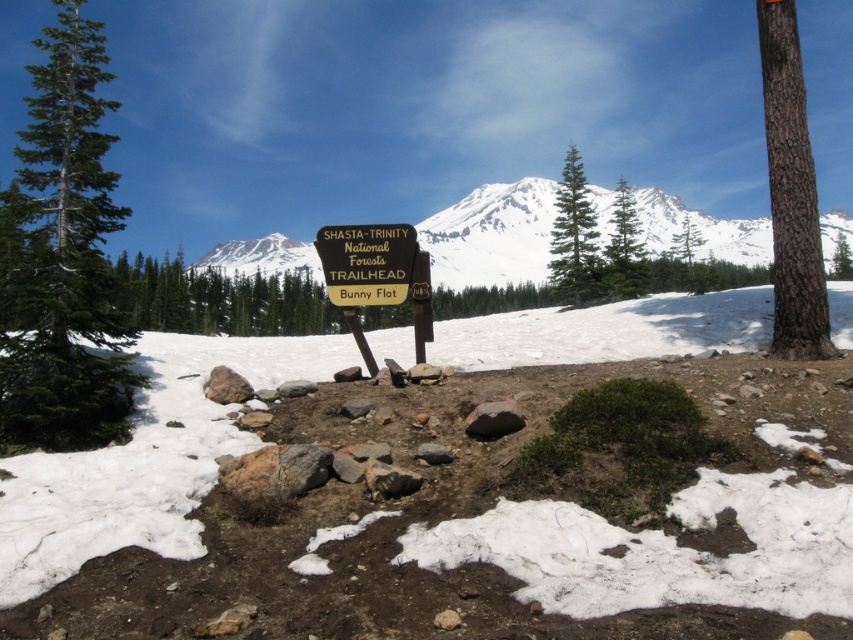
Does snowy white mountain at center have a lesser height compared to green matte tree at center?

Correct, snowy white mountain at center is not as tall as green matte tree at center.

Who is lower down, snowy white mountain at center or green matte tree at center?

snowy white mountain at center

Describe the element at coordinates (492, 236) in the screenshot. This screenshot has width=853, height=640. I see `snowy white mountain at center` at that location.

At what (x,y) coordinates should I click in order to perform the action: click on snowy white mountain at center. Please return your answer as a coordinate pair (x, y). Image resolution: width=853 pixels, height=640 pixels. Looking at the image, I should click on (492, 236).

From the picture: Measure the distance between brown rough bark tree at right and camera.

They are 13.50 meters apart.

Who is positioned more to the left, brown rough bark tree at right or yellow wood sign at center?

Positioned to the left is yellow wood sign at center.

Between point (776, 168) and point (334, 243), which one is positioned in front?

Positioned in front is point (776, 168).

Image resolution: width=853 pixels, height=640 pixels. I want to click on brown rough bark tree at right, so click(791, 193).

From the picture: Is yellow wood sign at center closer to camera compared to green textured pine tree at upper center?

Yes, it is.

Does point (363, 266) come farther from viewer compared to point (618, 268)?

That is False.

This screenshot has width=853, height=640. Find the location of `yellow wood sign at center`. yellow wood sign at center is located at coordinates (366, 262).